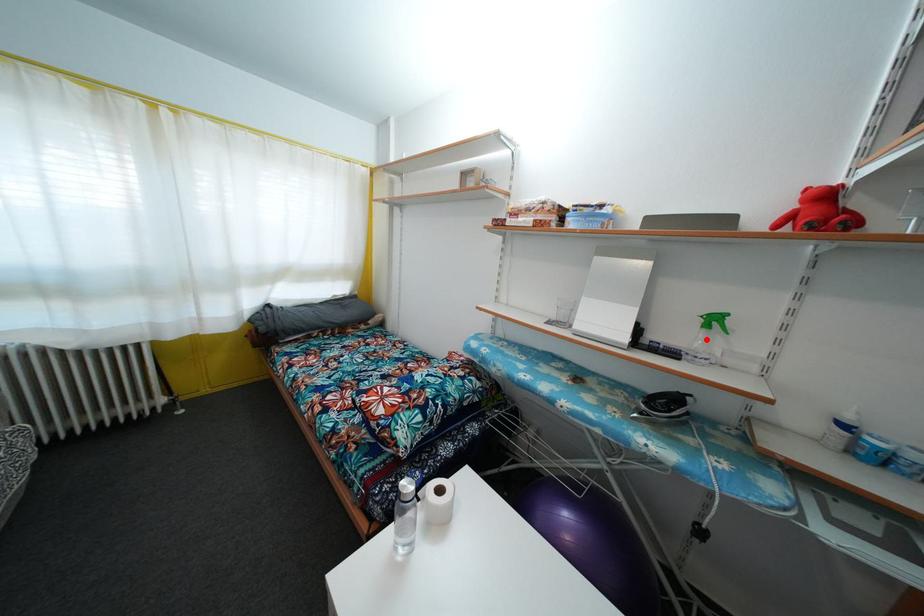
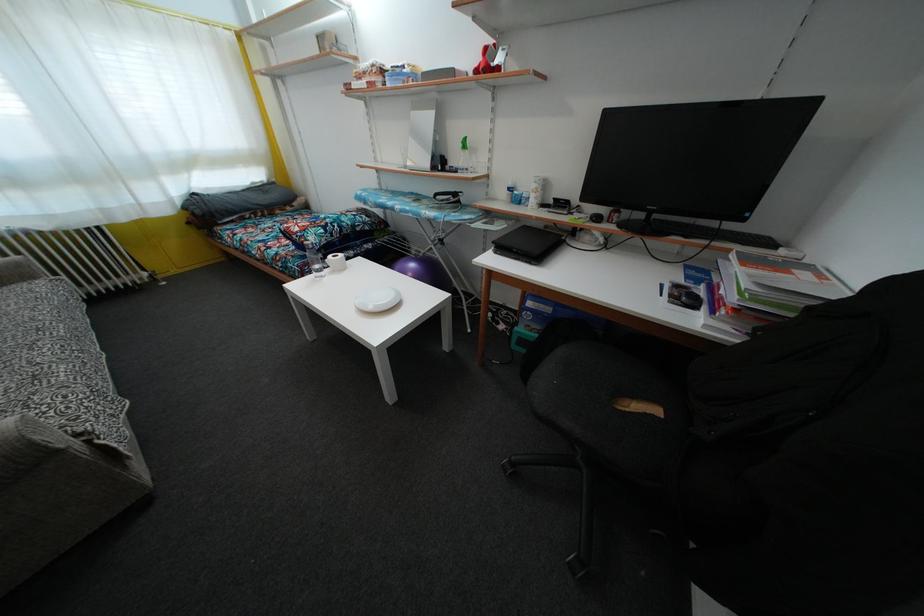
Locate, in the second image, the point that corresponds to the highlighted location in the first image.

(467, 160)